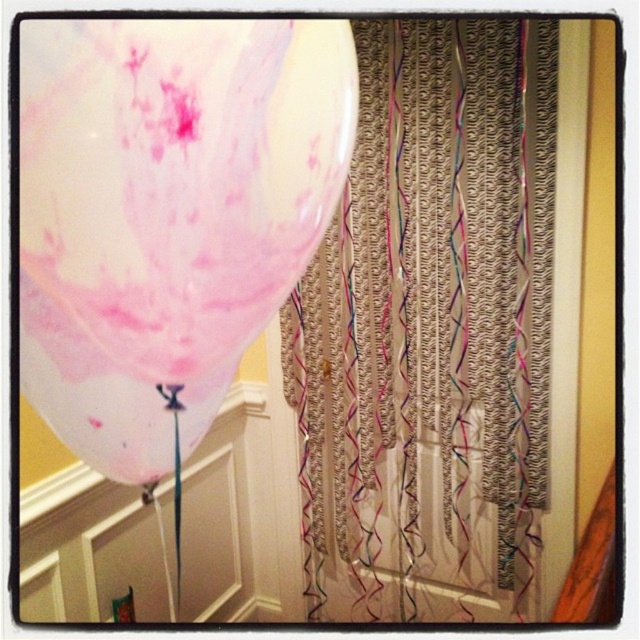
You are standing in a room and want to reach both the textured beige curtain at center and the translucent pink balloon at upper left. Which object is closer to you?

The textured beige curtain at center is closer to you because it is further to the viewer than the translucent pink balloon at upper left.

You are planning to hang a new decoration in the room. You have a wide poster that needs to fit between the textured beige curtain at center and the translucent pink balloon at upper left. Based on their widths, will the poster fit without overlapping either object?

The textured beige curtain at center is wider than the translucent pink balloon at upper left, so the poster may fit between them without overlapping if positioned correctly.